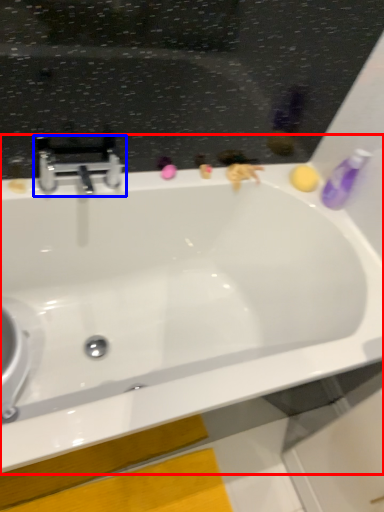
Question: Which object appears closest to the camera in this image, bathtub (highlighted by a red box) or tap (highlighted by a blue box)?

Choices:
 (A) bathtub
 (B) tap

Answer: (A)